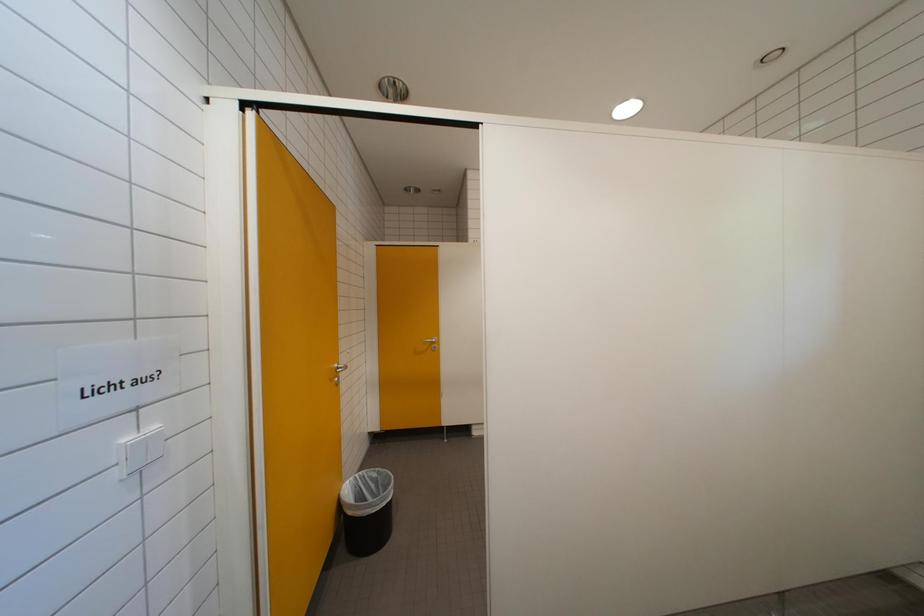
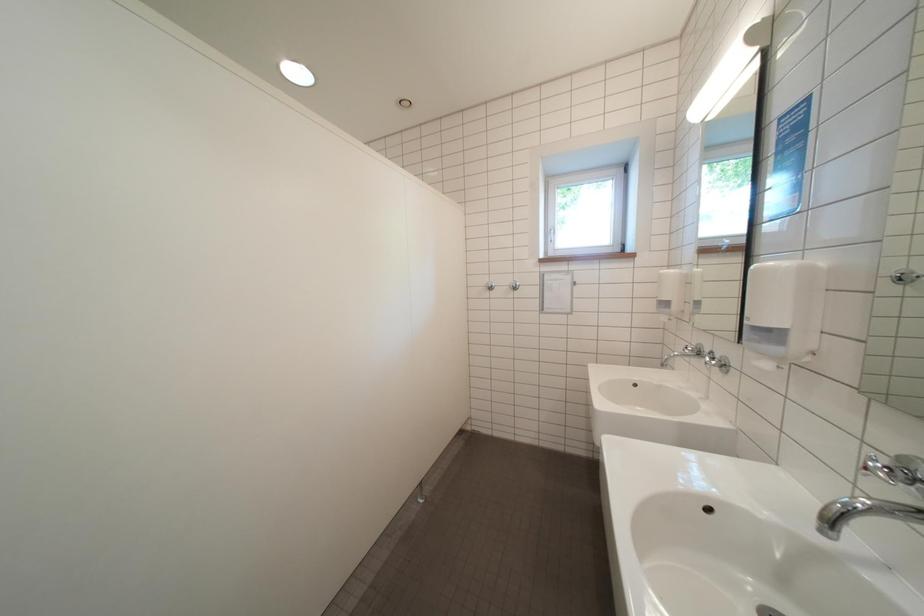
Question: Based on the continuous images, in which direction is the camera rotating? Reply with the corresponding letter.

Choices:
 (A) Left
 (B) Right
 (C) Up
 (D) Down

Answer: (B)